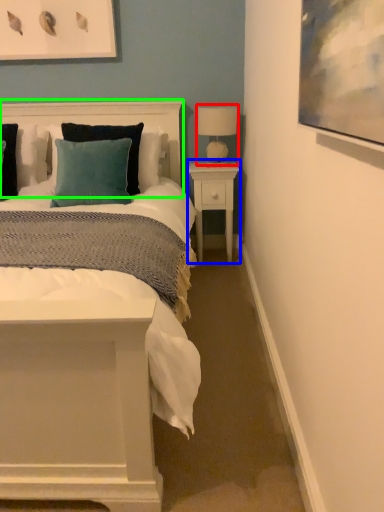
Question: Which object is the farthest from table lamp (highlighted by a red box)? Choose among these: nightstand (highlighted by a blue box) or headboard (highlighted by a green box).

Choices:
 (A) nightstand
 (B) headboard

Answer: (B)